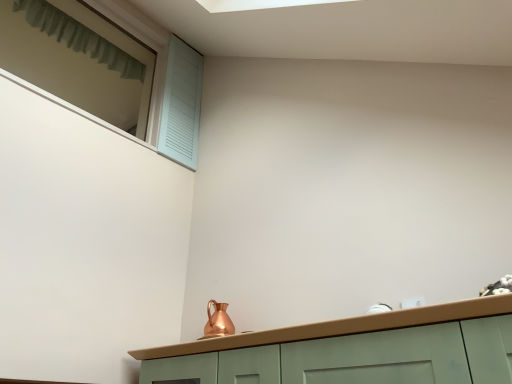
Question: Is light blue wooden shutter at upper left surrounded by copper metallic pitcher at center?

Choices:
 (A) yes
 (B) no

Answer: (B)

Question: Is copper metallic pitcher at center wider than light blue wooden shutter at upper left?

Choices:
 (A) yes
 (B) no

Answer: (B)

Question: From a real-world perspective, is copper metallic pitcher at center on light blue wooden shutter at upper left?

Choices:
 (A) no
 (B) yes

Answer: (A)

Question: Does copper metallic pitcher at center have a greater height compared to light blue wooden shutter at upper left?

Choices:
 (A) yes
 (B) no

Answer: (B)

Question: Is the position of copper metallic pitcher at center more distant than that of light blue wooden shutter at upper left?

Choices:
 (A) yes
 (B) no

Answer: (B)

Question: From a real-world perspective, is light blue wooden shutter at upper left above or below green fabric curtain at upper left?

Choices:
 (A) below
 (B) above

Answer: (A)

Question: From the image's perspective, is light blue wooden shutter at upper left positioned above or below green fabric curtain at upper left?

Choices:
 (A) below
 (B) above

Answer: (A)

Question: Looking at their shapes, would you say light blue wooden shutter at upper left is wider or thinner than green fabric curtain at upper left?

Choices:
 (A) wide
 (B) thin

Answer: (A)

Question: Based on their sizes in the image, would you say light blue wooden shutter at upper left is bigger or smaller than green fabric curtain at upper left?

Choices:
 (A) small
 (B) big

Answer: (B)

Question: From a real-world perspective, relative to light blue wooden shutter at upper left, is green fabric curtain at upper left vertically above or below?

Choices:
 (A) above
 (B) below

Answer: (A)

Question: Does point pyautogui.click(x=38, y=9) appear closer or farther from the camera than point pyautogui.click(x=50, y=33)?

Choices:
 (A) closer
 (B) farther

Answer: (A)

Question: From their relative heights in the image, would you say green fabric curtain at upper left is taller or shorter than light blue wooden shutter at upper left?

Choices:
 (A) short
 (B) tall

Answer: (A)

Question: Which is correct: green fabric curtain at upper left is inside light blue wooden shutter at upper left, or outside of it?

Choices:
 (A) outside
 (B) inside

Answer: (A)

Question: Which is correct: light blue wooden shutter at upper left is inside copper metallic pitcher at center, or outside of it?

Choices:
 (A) inside
 (B) outside

Answer: (B)

Question: From their relative heights in the image, would you say light blue wooden shutter at upper left is taller or shorter than copper metallic pitcher at center?

Choices:
 (A) short
 (B) tall

Answer: (B)